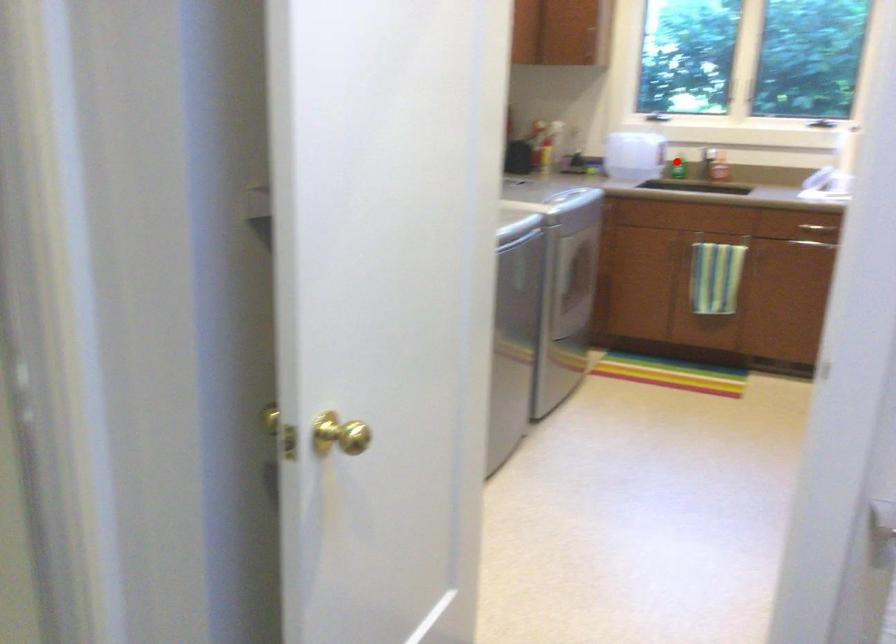
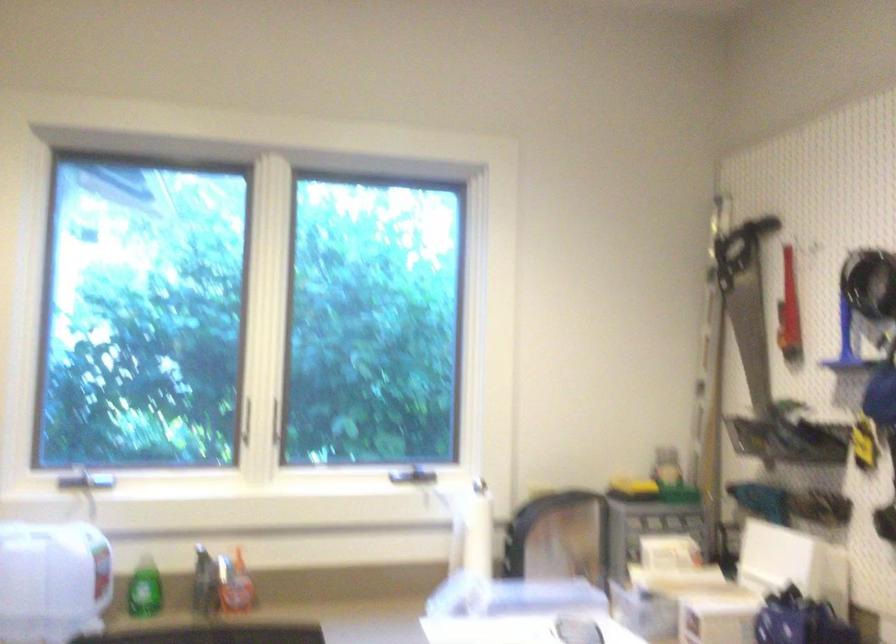
In the second image, find the point that corresponds to the highlighted location in the first image.

(143, 589)